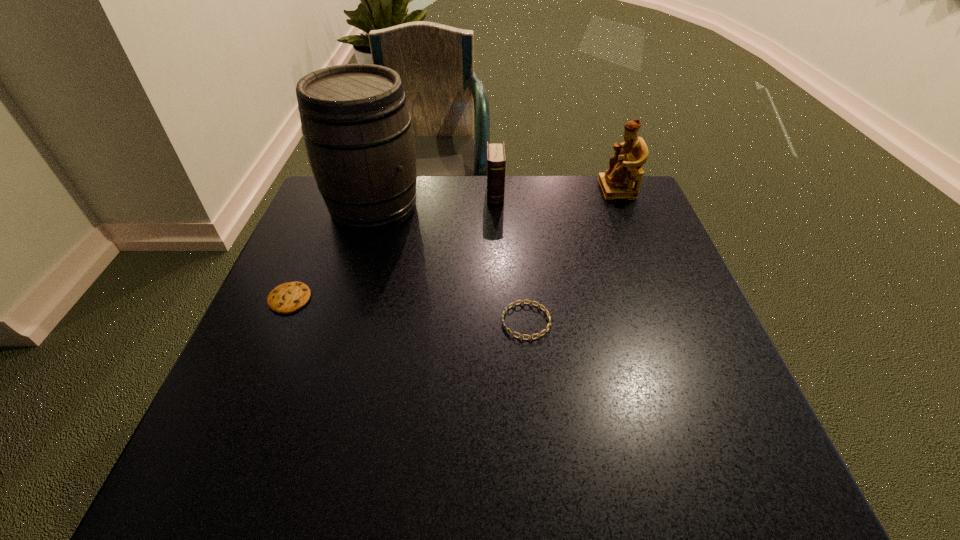
Locate an element on the screen. Image resolution: width=960 pixels, height=540 pixels. object situated at the right edge is located at coordinates (618, 182).

This screenshot has height=540, width=960. I want to click on object situated at the far left corner, so click(x=357, y=130).

Image resolution: width=960 pixels, height=540 pixels. What are the coordinates of `object present at the far right corner` in the screenshot? It's located at (618, 182).

In the image, there is a desktop. Where is `vacant region at the far edge`? The height and width of the screenshot is (540, 960). vacant region at the far edge is located at coordinates (516, 175).

Locate an element on the screen. The width and height of the screenshot is (960, 540). vacant space at the left edge of the desktop is located at coordinates (341, 248).

Locate an element on the screen. Image resolution: width=960 pixels, height=540 pixels. vacant space at the right edge is located at coordinates (623, 296).

This screenshot has width=960, height=540. I want to click on free location at the near left corner, so click(x=277, y=469).

Find the location of a particular element. This screenshot has width=960, height=540. vacant area at the near right corner of the desktop is located at coordinates (764, 449).

Image resolution: width=960 pixels, height=540 pixels. What are the coordinates of `free space that is in between the bracelet and the cookie` in the screenshot? It's located at (408, 310).

This screenshot has height=540, width=960. What are the coordinates of `vacant area that lies between the bracelet and the tallest object` in the screenshot? It's located at (450, 264).